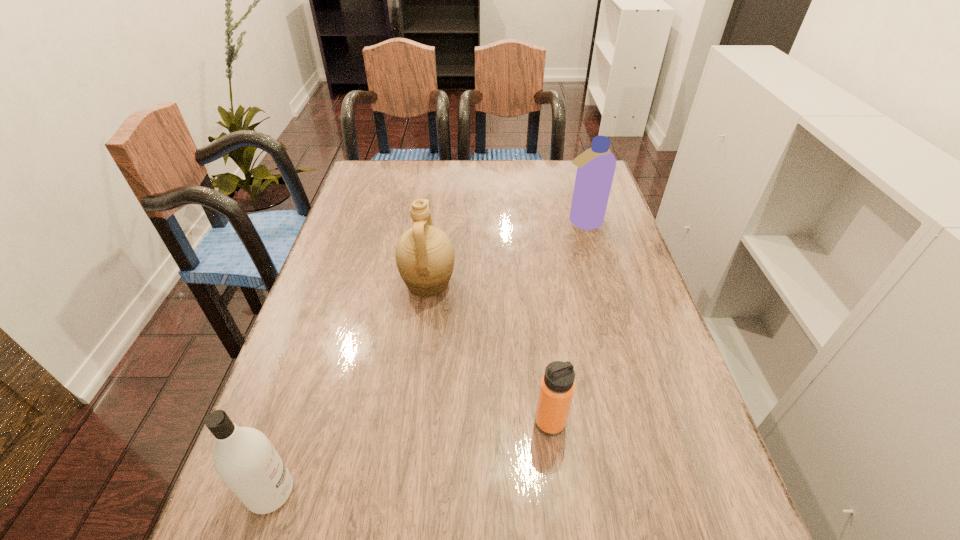
Identify the location of the farthest object. (596, 166).

Where is `the farther shampoo`? This screenshot has width=960, height=540. the farther shampoo is located at coordinates (596, 166).

The height and width of the screenshot is (540, 960). Identify the location of pitcher. (424, 254).

You are a GUI agent. You are given a task and a screenshot of the screen. Output one action in this format:
    pyautogui.click(x=<x>, y=<y>)
    Task: Click on the second object from left to right
    This screenshot has width=960, height=540.
    Given the screenshot: What is the action you would take?
    pyautogui.click(x=424, y=254)

Where is `the leftmost object`? This screenshot has width=960, height=540. the leftmost object is located at coordinates [244, 458].

Locate an element on the screen. This screenshot has width=960, height=540. the left shampoo is located at coordinates (244, 458).

The height and width of the screenshot is (540, 960). What are the coordinates of `the second nearest object` in the screenshot? It's located at (557, 386).

In order to click on thermos bottle in this screenshot , I will do `click(557, 386)`.

Identify the location of vacant area located 0.060m on the left of the rightmost object. Image resolution: width=960 pixels, height=540 pixels. (541, 222).

Where is `free space located 0.330m on the right of the second farthest object`? free space located 0.330m on the right of the second farthest object is located at coordinates (581, 284).